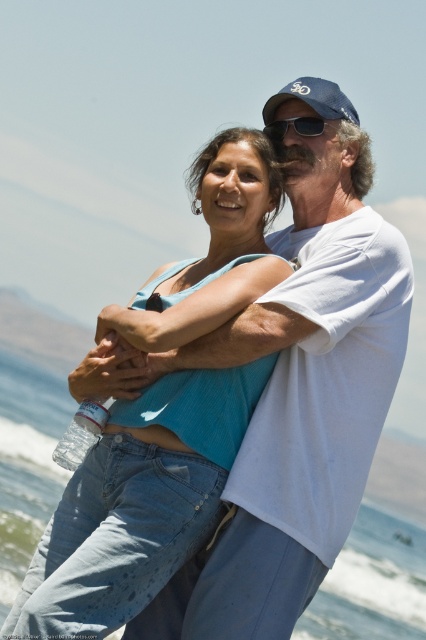
The width and height of the screenshot is (426, 640). What do you see at coordinates (137, 504) in the screenshot?
I see `blue denim jeans at center` at bounding box center [137, 504].

Between blue denim jeans at center and transparent plastic water at center, which one has more height?

transparent plastic water at center

Find the location of a particular element. Image resolution: width=426 pixels, height=640 pixels. blue denim jeans at center is located at coordinates (137, 504).

Is white cotton t-shirt at center smaller than clear plastic bottle at lower left?

Indeed, white cotton t-shirt at center has a smaller size compared to clear plastic bottle at lower left.

Does point (333, 438) come behind point (94, 428)?

Yes, it is behind point (94, 428).

Locate an element on the screen. This screenshot has width=426, height=640. white cotton t-shirt at center is located at coordinates (291, 387).

Which of these two, blue denim jeans at center or black matte sunglasses at upper center, stands taller?

blue denim jeans at center is taller.

From the picture: Can you confirm if blue denim jeans at center is positioned below black matte sunglasses at upper center?

Correct, blue denim jeans at center is located below black matte sunglasses at upper center.

Image resolution: width=426 pixels, height=640 pixels. What are the coordinates of `blue denim jeans at center` in the screenshot? It's located at (137, 504).